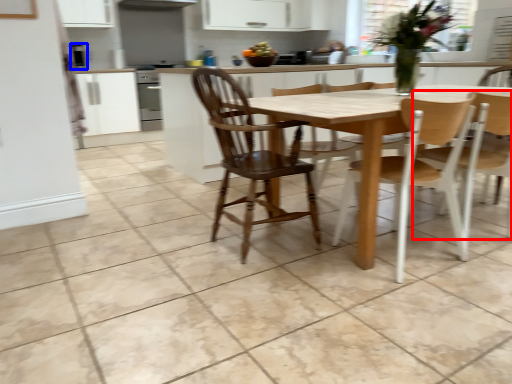
Question: Among these objects, which one is nearest to the camera, chair (highlighted by a red box) or appliance (highlighted by a blue box)?

Choices:
 (A) chair
 (B) appliance

Answer: (A)